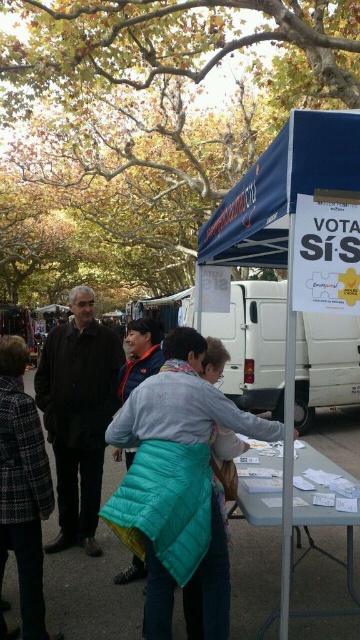
Question: Which object appears farthest from the camera in this image?

Choices:
 (A) blue fabric canopy at center
 (B) plaid wool coat at center

Answer: (B)

Question: Estimate the real-world distances between objects in this image. Which object is closer to the dark brown leather jacket at left?

Choices:
 (A) blue fabric canopy at center
 (B) white matte van at center
 (C) plaid wool coat at center
 (D) teal quilted jacket at center

Answer: (C)

Question: Does white matte van at center appear on the right side of plaid wool coat at center?

Choices:
 (A) no
 (B) yes

Answer: (B)

Question: Is the position of teal quilted jacket at center less distant than that of plaid wool coat at center?

Choices:
 (A) yes
 (B) no

Answer: (A)

Question: Which object appears closest to the camera in this image?

Choices:
 (A) blue fabric canopy at center
 (B) teal quilted jacket at center
 (C) dark brown leather jacket at left
 (D) white matte van at center

Answer: (A)

Question: Is blue fabric canopy at center bigger than plaid wool coat at center?

Choices:
 (A) yes
 (B) no

Answer: (A)